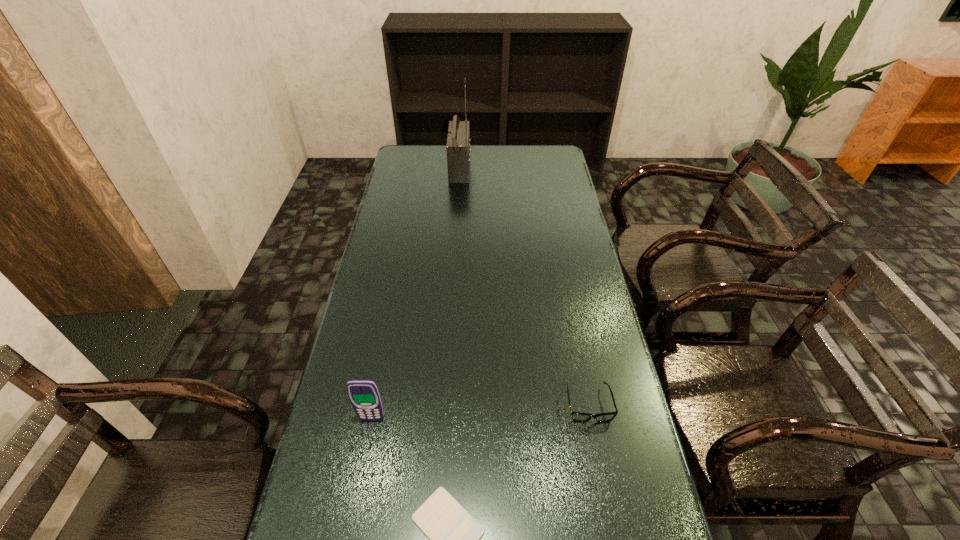
You are a GUI agent. You are given a task and a screenshot of the screen. Output one action in this format:
    pyautogui.click(x=<x>, y=<y>)
    Task: Click on the object at the left edge
    
    Given the screenshot: What is the action you would take?
    pyautogui.click(x=364, y=394)

At what (x,y) coordinates should I click in order to perform the action: click on object that is at the right edge. Please return your answer as a coordinate pair (x, y). This screenshot has height=540, width=960. Looking at the image, I should click on (579, 417).

The width and height of the screenshot is (960, 540). I want to click on free space at the left edge of the desktop, so click(x=336, y=430).

Locate an element on the screen. This screenshot has width=960, height=540. vacant position at the right edge of the desktop is located at coordinates (604, 340).

In the image, there is a desktop. Where is `free space at the far left corner`? The image size is (960, 540). free space at the far left corner is located at coordinates (424, 157).

Where is `vacant point at the far right corner`? vacant point at the far right corner is located at coordinates (540, 154).

In order to click on free space between the second shortest object and the second tallest object in this screenshot , I will do `click(480, 411)`.

In order to click on unoccupied area between the third shortest object and the radio receiver in this screenshot , I will do `click(416, 294)`.

The image size is (960, 540). I want to click on free space between the radio receiver and the sunglasses, so click(x=524, y=287).

Identify which object is located as the nearest to the leftmost object. Please provide its 2D coordinates. Your answer should be formatted as a tuple, i.e. [(x, y)], where the tuple contains the x and y coordinates of a point satisfying the conditions above.

[(454, 534)]